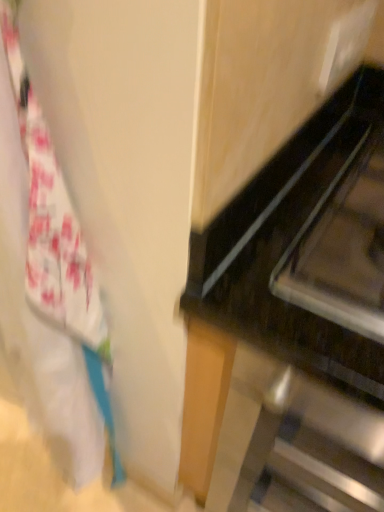
Question: Is white fabric at left at the back of black glossy oven at right?

Choices:
 (A) no
 (B) yes

Answer: (A)

Question: From the image's perspective, is black glossy oven at right under white fabric at left?

Choices:
 (A) yes
 (B) no

Answer: (A)

Question: Is black glossy oven at right behind white fabric at left?

Choices:
 (A) yes
 (B) no

Answer: (A)

Question: From the image's perspective, is black glossy oven at right on top of white fabric at left?

Choices:
 (A) no
 (B) yes

Answer: (A)

Question: From a real-world perspective, is black glossy oven at right over white fabric at left?

Choices:
 (A) yes
 (B) no

Answer: (B)

Question: From a real-world perspective, is black glossy oven at right located beneath white fabric at left?

Choices:
 (A) yes
 (B) no

Answer: (A)

Question: Does white fabric at left have a larger size compared to black glossy oven at right?

Choices:
 (A) yes
 (B) no

Answer: (B)

Question: Is white fabric at left far away from black glossy oven at right?

Choices:
 (A) yes
 (B) no

Answer: (B)

Question: From a real-world perspective, does white fabric at left sit lower than black glossy oven at right?

Choices:
 (A) no
 (B) yes

Answer: (A)

Question: Does white fabric at left have a greater width compared to black glossy oven at right?

Choices:
 (A) yes
 (B) no

Answer: (B)

Question: Considering the relative sizes of white fabric at left and black glossy oven at right in the image provided, is white fabric at left smaller than black glossy oven at right?

Choices:
 (A) no
 (B) yes

Answer: (B)

Question: Could you tell me if white fabric at left is facing black glossy oven at right?

Choices:
 (A) yes
 (B) no

Answer: (B)

Question: Considering their positions, is black glossy oven at right located in front of or behind white fabric at left?

Choices:
 (A) behind
 (B) front

Answer: (A)